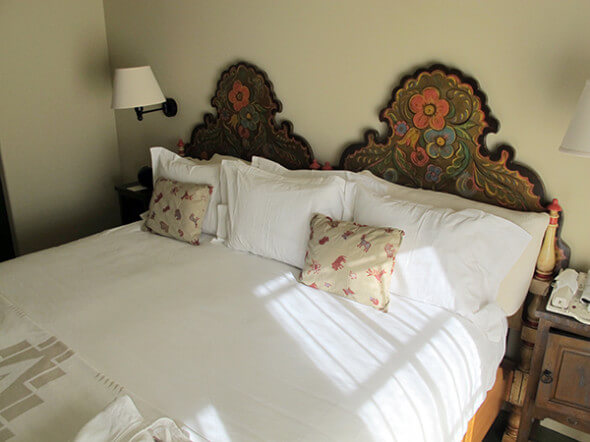
Identify the location of phone. The width and height of the screenshot is (590, 442). (565, 295).